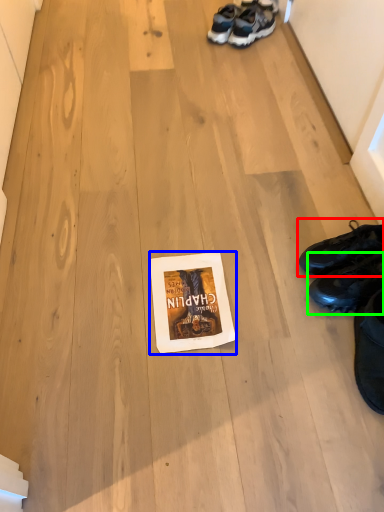
Question: Estimate the real-world distances between objects in this image. Which object is closer to footwear (highlighted by a red box), paperback book (highlighted by a blue box) or footwear (highlighted by a green box)?

Choices:
 (A) paperback book
 (B) footwear

Answer: (B)